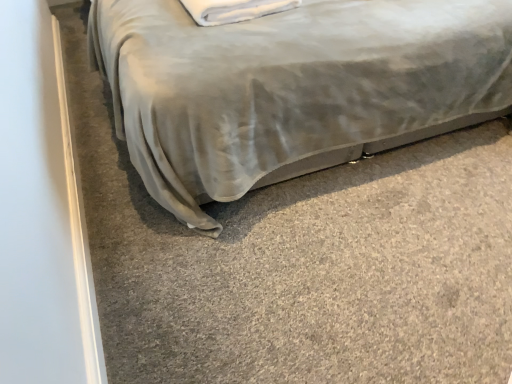
Question: Is satin gray bed at center at the right side of white soft pillow at upper center?

Choices:
 (A) yes
 (B) no

Answer: (A)

Question: From a real-world perspective, does satin gray bed at center stand above white soft pillow at upper center?

Choices:
 (A) yes
 (B) no

Answer: (B)

Question: Would you say white soft pillow at upper center is part of satin gray bed at center's contents?

Choices:
 (A) yes
 (B) no

Answer: (A)

Question: Is satin gray bed at center smaller than white soft pillow at upper center?

Choices:
 (A) no
 (B) yes

Answer: (A)

Question: Is satin gray bed at center in front of white soft pillow at upper center?

Choices:
 (A) yes
 (B) no

Answer: (A)

Question: Considering the relative sizes of satin gray bed at center and white soft pillow at upper center in the image provided, is satin gray bed at center thinner than white soft pillow at upper center?

Choices:
 (A) no
 (B) yes

Answer: (A)

Question: Is white soft pillow at upper center positioned beyond the bounds of satin gray bed at center?

Choices:
 (A) yes
 (B) no

Answer: (B)

Question: Is white soft pillow at upper center further to camera compared to satin gray bed at center?

Choices:
 (A) no
 (B) yes

Answer: (B)

Question: Does white soft pillow at upper center have a lesser width compared to satin gray bed at center?

Choices:
 (A) no
 (B) yes

Answer: (B)

Question: Can you confirm if white soft pillow at upper center is bigger than satin gray bed at center?

Choices:
 (A) yes
 (B) no

Answer: (B)

Question: Is white soft pillow at upper center to the left of satin gray bed at center from the viewer's perspective?

Choices:
 (A) no
 (B) yes

Answer: (B)

Question: Does white soft pillow at upper center have a lesser height compared to satin gray bed at center?

Choices:
 (A) yes
 (B) no

Answer: (A)

Question: Is satin gray bed at center bigger or smaller than white soft pillow at upper center?

Choices:
 (A) small
 (B) big

Answer: (B)